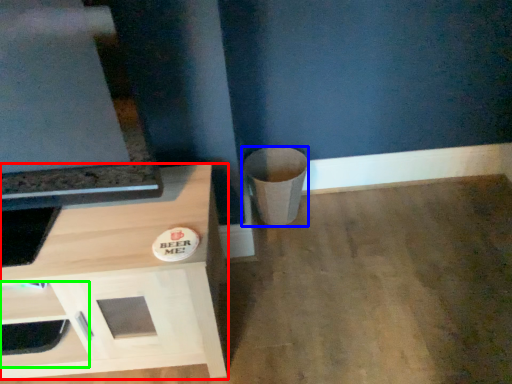
Question: Based on their relative distances, which object is farther from cabinetry (highlighted by a red box)? Choose from trash bin/can (highlighted by a blue box) and drawer (highlighted by a green box).

Choices:
 (A) trash bin/can
 (B) drawer

Answer: (A)